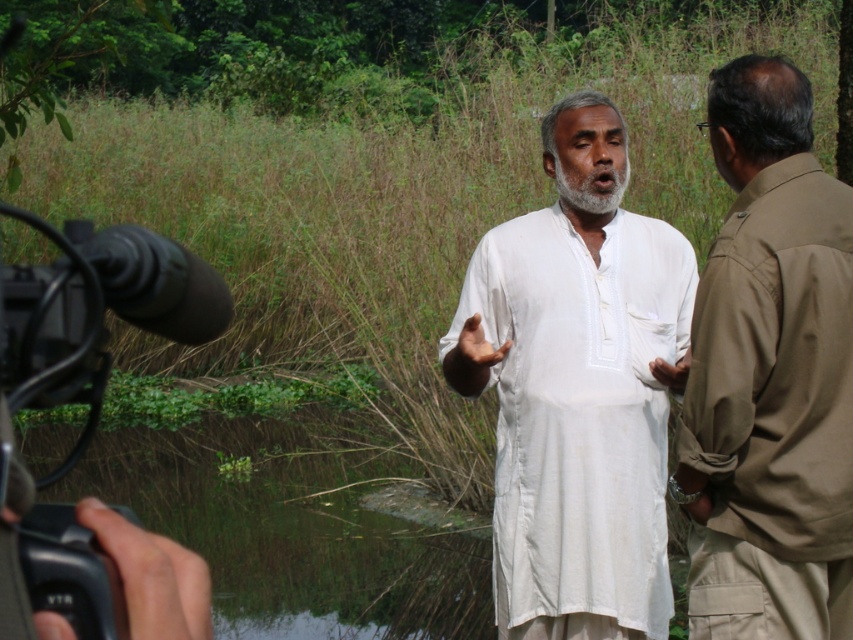
Who is more forward, (x=630, y=452) or (x=782, y=444)?

Positioned in front is point (x=782, y=444).

Can you confirm if white cotton kurta at center is bigger than khaki cotton shirt at right?

Yes, white cotton kurta at center is bigger than khaki cotton shirt at right.

Who is more forward, [566,120] or [817,452]?

Positioned in front is point [817,452].

In order to click on white cotton kurta at center in this screenshot , I will do `click(578, 388)`.

Is white cotton kurta at center closer to the viewer compared to black plastic video camera at lower left?

No, it is behind black plastic video camera at lower left.

Find the location of `white cotton kurta at center`. white cotton kurta at center is located at coordinates (578, 388).

The height and width of the screenshot is (640, 853). Describe the element at coordinates (772, 413) in the screenshot. I see `khaki cotton shirt at right` at that location.

Who is more forward, (845, 586) or (15, 445)?

Point (15, 445) is more forward.

Identify the location of khaki cotton shirt at right. (772, 413).